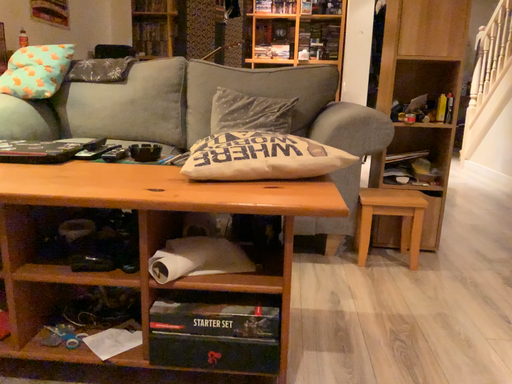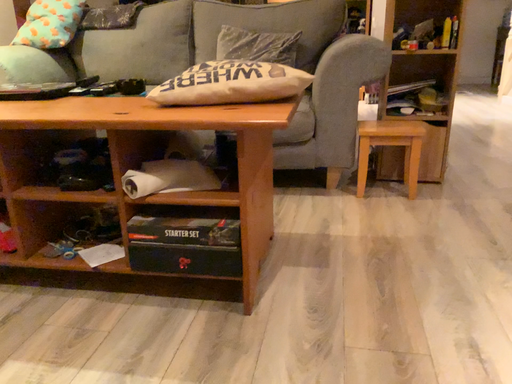
Question: How did the camera likely rotate when shooting the video?

Choices:
 (A) rotated left
 (B) rotated right

Answer: (A)